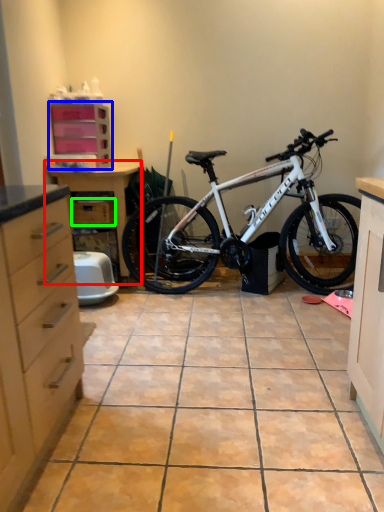
Question: Estimate the real-world distances between objects in this image. Which object is farther from dresser (highlighted by a red box), cabinetry (highlighted by a blue box) or drawer (highlighted by a green box)?

Choices:
 (A) cabinetry
 (B) drawer

Answer: (A)